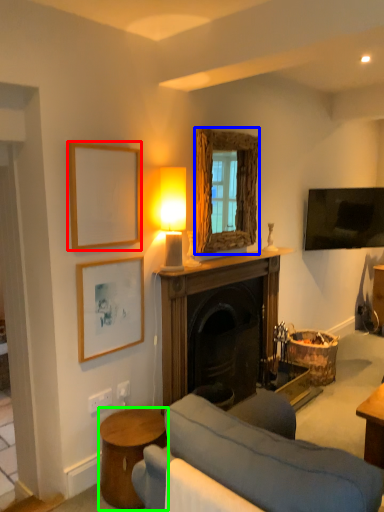
Question: Estimate the real-world distances between objects in this image. Which object is farther from picture frame (highlighted by a red box), window screen (highlighted by a blue box) or table (highlighted by a green box)?

Choices:
 (A) window screen
 (B) table

Answer: (B)